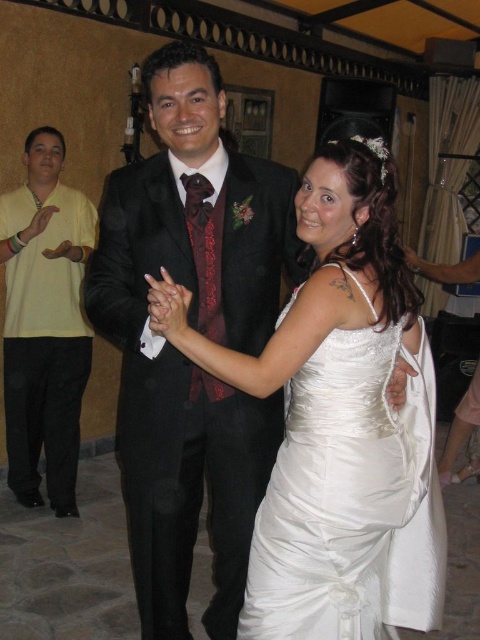
You are a photographer at the wedding reception. You need to capture a photo of the satin white dress at center and the yellow cotton shirt at left. Which one will have its hemline visible in the photo?

The satin white dress at center is shorter than the yellow cotton shirt at left, so the hemline of the yellow cotton shirt at left will be visible in the photo.

You are a photographer positioned at the back of the reception hall. You need to capture a group photo of the satin white dress at center and the yellow cotton shirt at left. The camera you are using has a minimum focus distance of 2 meters. Will you be able to focus on both subjects clearly?

The distance between the satin white dress at center and the yellow cotton shirt at left is 1.99 meters. Since the camera requires a minimum focus distance of 2 meters, you will not be able to focus both subjects clearly as the distance is slightly less than required.